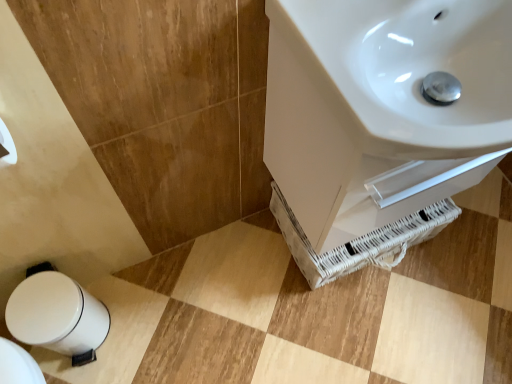
Describe the element at coordinates (58, 316) in the screenshot. I see `white glossy trash can at lower left` at that location.

In order to click on white glossy trash can at lower left in this screenshot , I will do `click(58, 316)`.

This screenshot has width=512, height=384. What do you see at coordinates (404, 71) in the screenshot?
I see `white glossy sink at upper right` at bounding box center [404, 71].

Where is `white glossy sink at upper right`? white glossy sink at upper right is located at coordinates (404, 71).

The width and height of the screenshot is (512, 384). I want to click on white glossy trash can at lower left, so click(x=58, y=316).

Is white glossy trash can at lower left at the left side of white glossy sink at upper right?

Correct, you'll find white glossy trash can at lower left to the left of white glossy sink at upper right.

Which object is closer to the camera, white glossy trash can at lower left or white glossy sink at upper right?

white glossy sink at upper right is in front.

Between point (46, 327) and point (286, 36), which one is positioned behind?

The point (46, 327) is behind.

From the image's perspective, is white glossy trash can at lower left located above or below white glossy sink at upper right?

white glossy trash can at lower left is situated lower than white glossy sink at upper right in the image.

In the scene shown: From a real-world perspective, is white glossy trash can at lower left below white glossy sink at upper right?

Correct, in the physical world, white glossy trash can at lower left is lower than white glossy sink at upper right.

Does white glossy trash can at lower left have a lesser width compared to white glossy sink at upper right?

Yes.

Is white glossy trash can at lower left shorter than white glossy sink at upper right?

Incorrect, the height of white glossy trash can at lower left does not fall short of that of white glossy sink at upper right.

Who is smaller, white glossy trash can at lower left or white glossy sink at upper right?

With smaller size is white glossy trash can at lower left.

Is white glossy trash can at lower left not inside white glossy sink at upper right?

That's correct, white glossy trash can at lower left is outside of white glossy sink at upper right.

Looking at this image, is white glossy trash can at lower left not close to white glossy sink at upper right?

No, white glossy trash can at lower left is not far from white glossy sink at upper right.

Consider the image. Is white glossy trash can at lower left facing towards white glossy sink at upper right?

No.

How many degrees apart are the facing directions of white glossy trash can at lower left and white glossy sink at upper right?

The facing directions of white glossy trash can at lower left and white glossy sink at upper right are 90.1 degrees apart.

Where is `bidet that appears below the white glossy sink at upper right (from the image's perspective)`? This screenshot has width=512, height=384. bidet that appears below the white glossy sink at upper right (from the image's perspective) is located at coordinates (58, 316).

Is white glossy sink at upper right at the right side of white glossy trash can at lower left?

A: Yes.

Is white glossy sink at upper right further to camera compared to white glossy trash can at lower left?

No, it is not.

Considering the positions of points (457, 137) and (76, 287), is point (457, 137) farther from camera compared to point (76, 287)?

No, it is in front of (76, 287).

From the image's perspective, would you say white glossy sink at upper right is positioned over white glossy trash can at lower left?

Yes, from the image's perspective, white glossy sink at upper right is above white glossy trash can at lower left.

From a real-world perspective, is white glossy sink at upper right physically above white glossy trash can at lower left?

Yes, from a real-world perspective, white glossy sink at upper right is on top of white glossy trash can at lower left.

Which of these two, white glossy sink at upper right or white glossy trash can at lower left, is wider?

With larger width is white glossy sink at upper right.

Can you confirm if white glossy sink at upper right is taller than white glossy trash can at lower left?

No.

Between white glossy sink at upper right and white glossy trash can at lower left, which one has larger size?

Bigger between the two is white glossy sink at upper right.

Choose the correct answer: Is white glossy sink at upper right inside white glossy trash can at lower left or outside it?

white glossy sink at upper right is outside white glossy trash can at lower left.

Is white glossy sink at upper right not near white glossy trash can at lower left?

No, white glossy sink at upper right is not far away from white glossy trash can at lower left.

Is white glossy sink at upper right positioned with its back to white glossy trash can at lower left?

Answer: That's not correct — white glossy sink at upper right is not looking away from white glossy trash can at lower left.

What's the angular difference between white glossy sink at upper right and white glossy trash can at lower left's facing directions?

90.1 degrees separate the facing orientations of white glossy sink at upper right and white glossy trash can at lower left.

How far apart are white glossy sink at upper right and white glossy trash can at lower left?

white glossy sink at upper right and white glossy trash can at lower left are 32.64 inches apart.

The height and width of the screenshot is (384, 512). What are the coordinates of `bidet below the white glossy sink at upper right (from a real-world perspective)` in the screenshot? It's located at (58, 316).

Image resolution: width=512 pixels, height=384 pixels. In order to click on bidet that appears below the white glossy sink at upper right (from the image's perspective) in this screenshot , I will do `click(58, 316)`.

The width and height of the screenshot is (512, 384). What are the coordinates of `sink on the right of the white glossy trash can at lower left` in the screenshot? It's located at (404, 71).